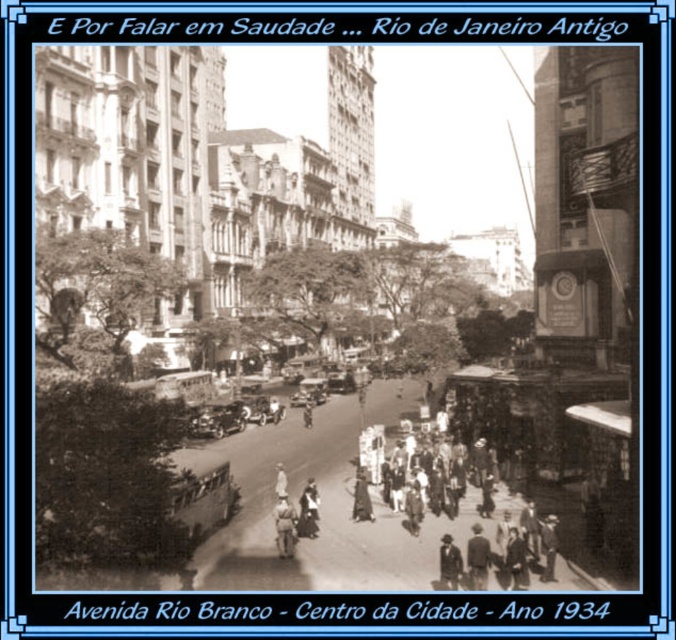
Question: Can you confirm if light brown leather coat at center is positioned to the right of dark gray fabric coat at center?

Choices:
 (A) yes
 (B) no

Answer: (A)

Question: Which of the following is the closest to the observer?

Choices:
 (A) (306, 419)
 (B) (481, 566)
 (C) (360, 493)
 (D) (274, 481)

Answer: (B)

Question: Based on their relative distances, which object is nearer to the dark gray fabric coat at center?

Choices:
 (A) light brown leather hat at lower center
 (B) light brown leather coat at center

Answer: (B)

Question: Which point is closer to the camera?

Choices:
 (A) dark gray fabric coat at center
 (B) light beige fabric coat at center
 (C) dark brown leather coat at lower right
 (D) light brown leather hat at lower center

Answer: (D)

Question: Does light brown leather hat at lower center appear over light brown leather jacket at center?

Choices:
 (A) no
 (B) yes

Answer: (A)

Question: Can you confirm if dark gray suit at center is positioned below light beige fabric coat at center?

Choices:
 (A) yes
 (B) no

Answer: (A)